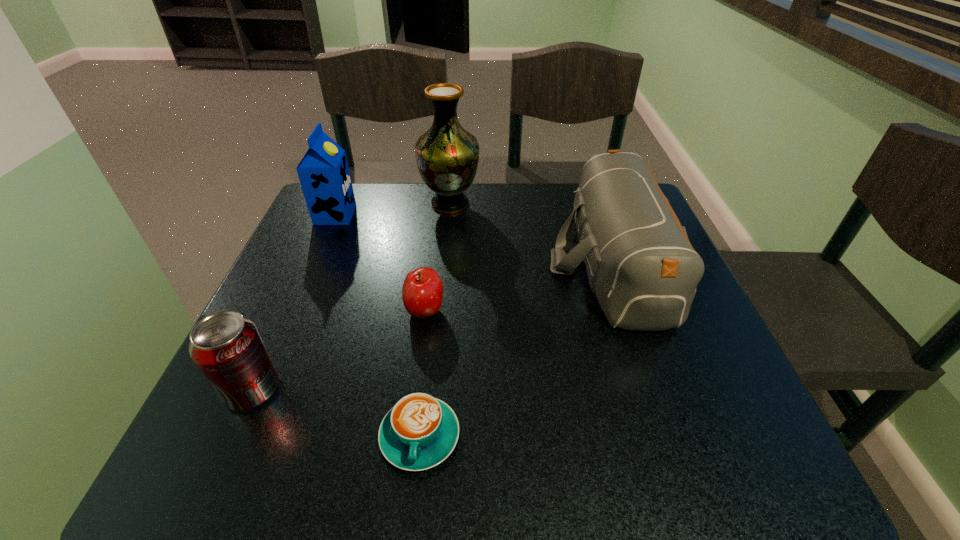
What are the coordinates of `empty location between the cappuccino and the second tallest object` in the screenshot? It's located at [377, 326].

Image resolution: width=960 pixels, height=540 pixels. What are the coordinates of `unoccupied area between the shortest object and the duffel bag` in the screenshot? It's located at (516, 349).

You are a GUI agent. You are given a task and a screenshot of the screen. Output one action in this format:
    pyautogui.click(x=<x>, y=<y>)
    Task: Click on the free space between the apple and the carton
    
    Given the screenshot: What is the action you would take?
    pyautogui.click(x=380, y=263)

You are a GUI agent. You are given a task and a screenshot of the screen. Output one action in this format:
    pyautogui.click(x=<x>, y=<y>)
    Task: Click on the free spot between the carton and the apple
    
    Given the screenshot: What is the action you would take?
    pyautogui.click(x=380, y=263)

The height and width of the screenshot is (540, 960). What are the coordinates of `free area in between the second shortest object and the carton` in the screenshot? It's located at (380, 263).

Find the location of a particular element. object that is the fifth closest one to the fifth tallest object is located at coordinates (323, 172).

Locate which object is the fourth closest to the fifth tallest object. Please provide its 2D coordinates. Your answer should be formatted as a tuple, i.e. [(x, y)], where the tuple contains the x and y coordinates of a point satisfying the conditions above.

[(447, 155)]

Where is `vacant point that satisfies the following two spatial constraints: 1. with the cap open on the third tallest object; 2. on the left side of the second tallest object`? Image resolution: width=960 pixels, height=540 pixels. vacant point that satisfies the following two spatial constraints: 1. with the cap open on the third tallest object; 2. on the left side of the second tallest object is located at coordinates (315, 263).

Find the location of `free space that satisfies the following two spatial constraints: 1. with the cap open on the second tallest object; 2. on the left side of the duffel bag`. free space that satisfies the following two spatial constraints: 1. with the cap open on the second tallest object; 2. on the left side of the duffel bag is located at coordinates (315, 263).

Identify the location of vacant region that satisfies the following two spatial constraints: 1. on the back side of the fourth tallest object; 2. on the left side of the tallest object. (335, 204).